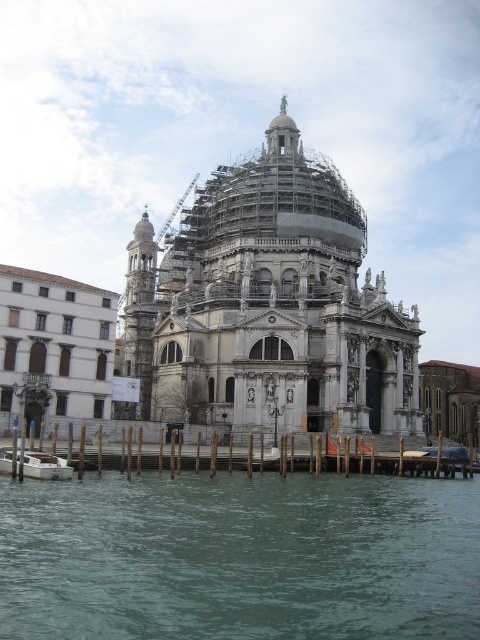
Question: Which point is closer to the camera taking this photo?

Choices:
 (A) (423, 452)
 (B) (66, 570)
 (C) (45, 461)
 (D) (369, 372)

Answer: (B)

Question: Is greenish water at lower center further to camera compared to wooden planks at lower center?

Choices:
 (A) no
 (B) yes

Answer: (A)

Question: Estimate the real-world distances between objects in this image. Which object is closer to the white marble dome at center?

Choices:
 (A) white glossy boat at lower left
 (B) greenish water at lower center
 (C) wooden planks at lower center

Answer: (C)

Question: Does white marble dome at center have a smaller size compared to white glossy boat at lower left?

Choices:
 (A) yes
 (B) no

Answer: (B)

Question: Which point is closer to the camera taking this photo?

Choices:
 (A) (450, 456)
 (B) (6, 458)
 (C) (344, 189)

Answer: (B)

Question: Does greenish water at lower center have a lesser width compared to white marble dome at center?

Choices:
 (A) no
 (B) yes

Answer: (A)